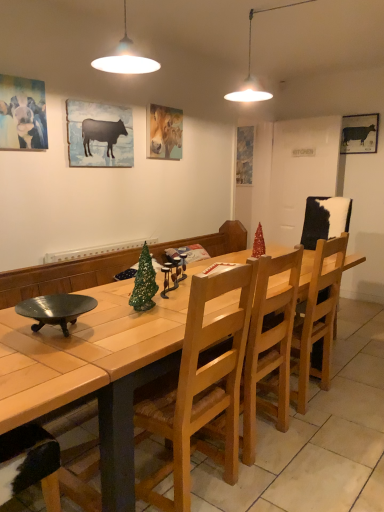
Where is `vacant area that lies in front of cowhide leather chair at right`? The image size is (384, 512). vacant area that lies in front of cowhide leather chair at right is located at coordinates (353, 370).